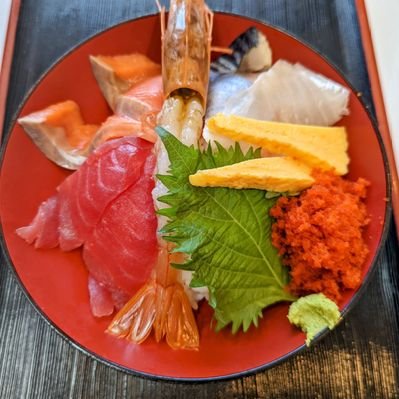
The width and height of the screenshot is (399, 399). I want to click on plate, so click(244, 351), click(61, 283), click(36, 190), click(89, 84), click(362, 148).